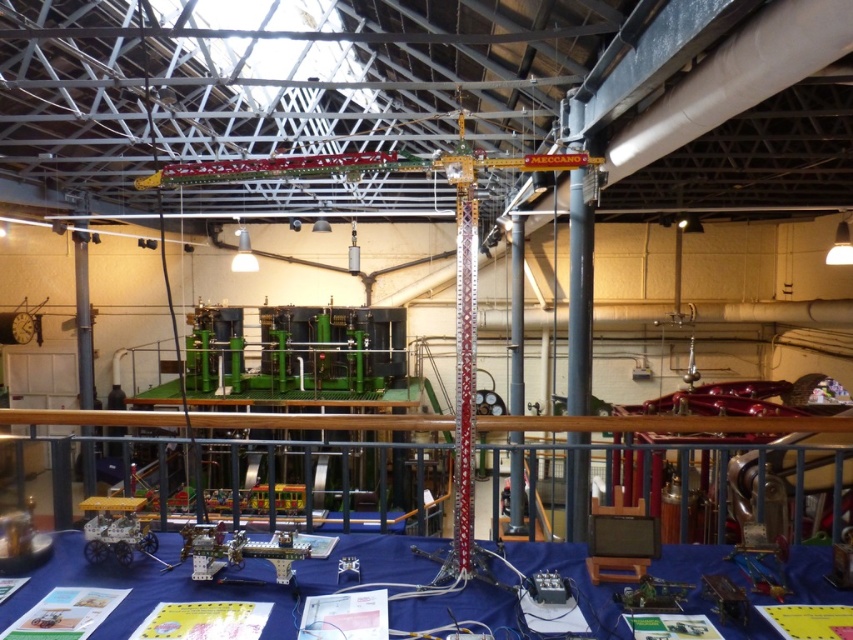
You are an engineer visiting the exhibition and need to place a large blueprint on the table. The blueprint is as wide as the metallic red crane at center. Will it fit on the blue fabric table at lower center?

The blue fabric table at lower center is wider than the metallic red crane at center, so the blueprint will fit on the blue fabric table at lower center.

You are standing in the exhibition hall and notice two points marked in the image. The first point is at coordinate point [283,161] and the second is at coordinate point [509,500]. Which of these two points is closer to your current position?

Point [283,161] is closer to the camera than point [509,500], so the first point is closer to your current position.

Looking at this image, you are an engineer attending the exhibition and need to place a large blueprint on the table. Given that the metallic gray pole at center is in the way, can you estimate whether the blue fabric table at lower center has enough space to accommodate the blueprint without moving the pole?

The blue fabric table at lower center has a larger width than the metallic gray pole at center, so there should be sufficient space to place the blueprint on the table without moving the pole.